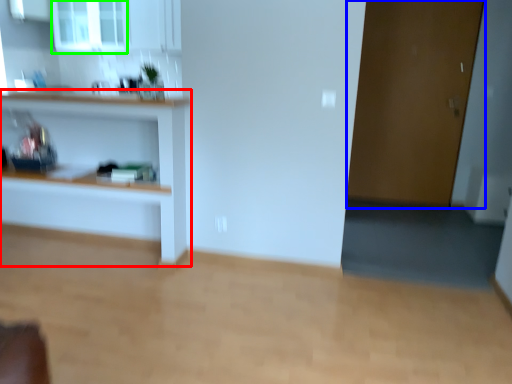
Question: Which is farther away from shelf (highlighted by a red box)? door (highlighted by a blue box) or window (highlighted by a green box)?

Choices:
 (A) door
 (B) window

Answer: (A)